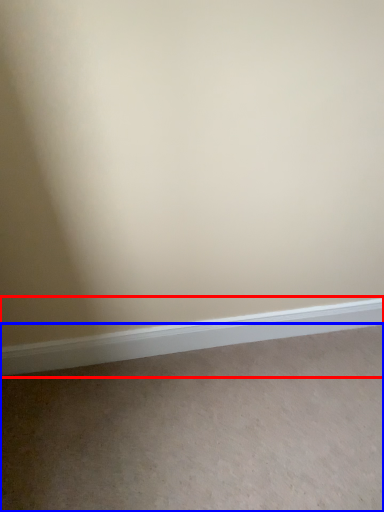
Question: Which object is closer to the camera taking this photo, window sill (highlighted by a red box) or plain (highlighted by a blue box)?

Choices:
 (A) window sill
 (B) plain

Answer: (B)